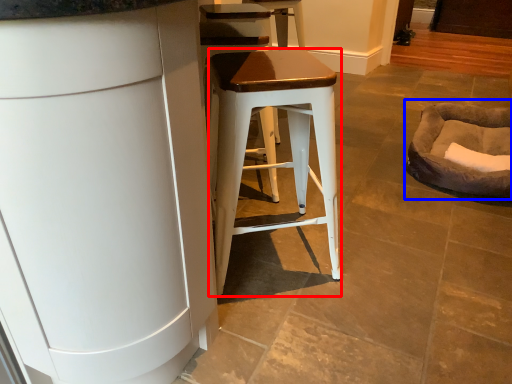
Question: Which object appears closest to the camera in this image, stool (highlighted by a red box) or bean bag chair (highlighted by a blue box)?

Choices:
 (A) stool
 (B) bean bag chair

Answer: (A)